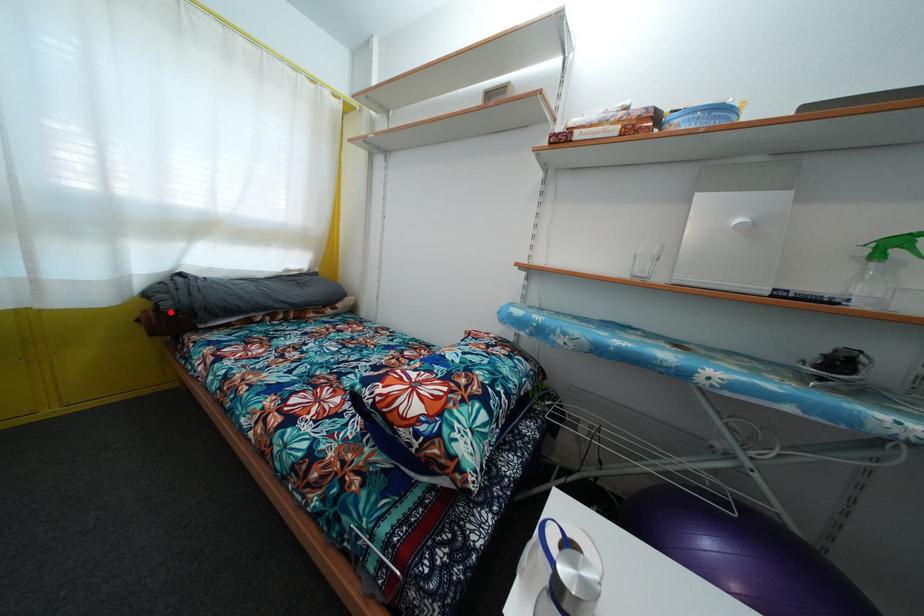
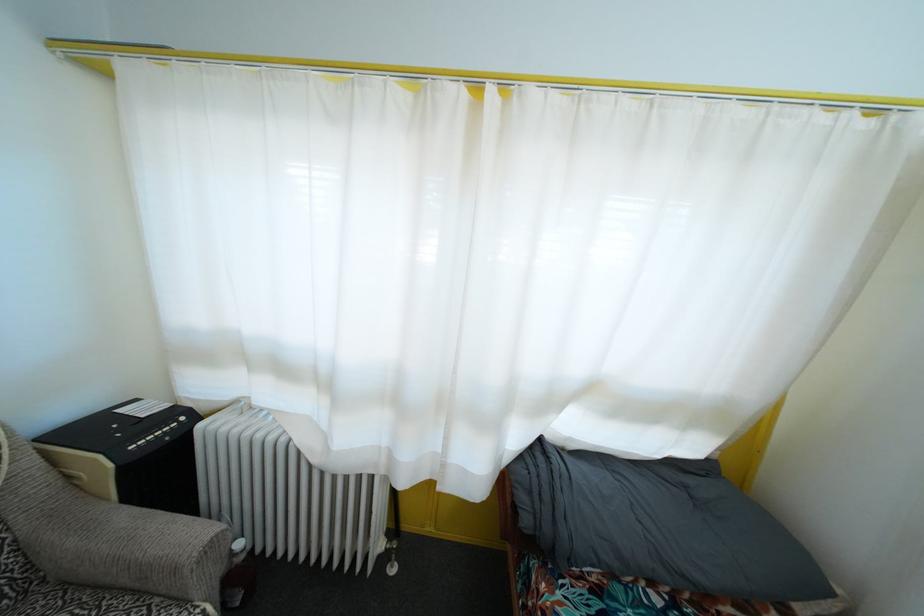
Where in the second image is the point corresponding to the highlighted location from the first image?

(529, 528)